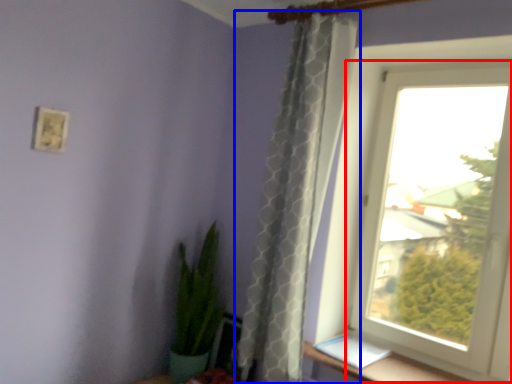
Question: Which object appears farthest to the camera in this image, window (highlighted by a red box) or curtain (highlighted by a blue box)?

Choices:
 (A) window
 (B) curtain

Answer: (A)